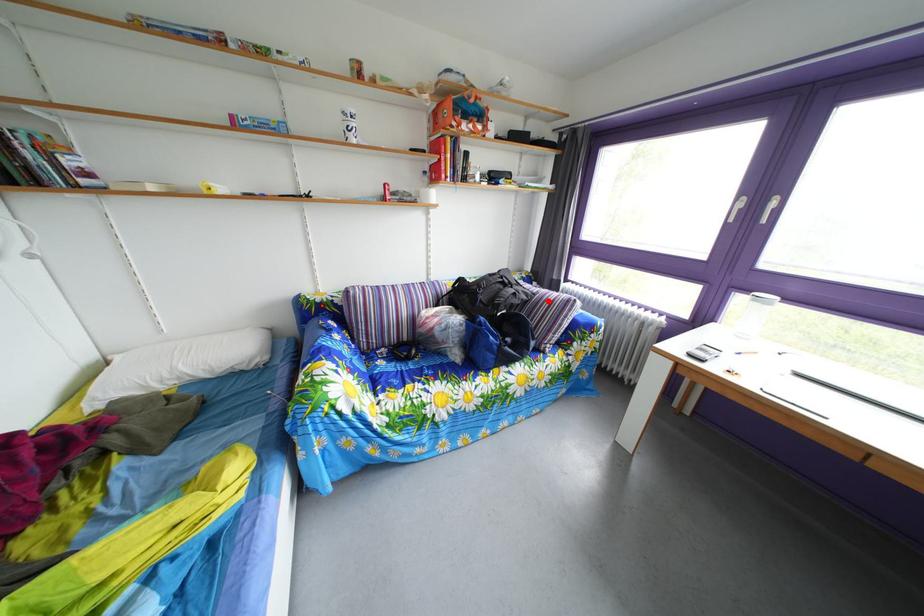
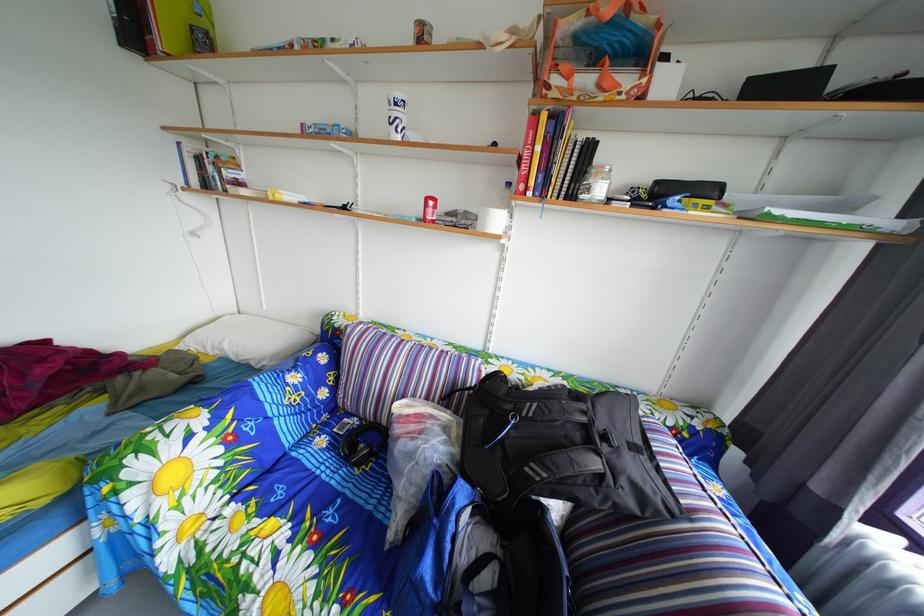
Where in the second image is the point corresponding to the highlighted location from the first image?

(699, 523)